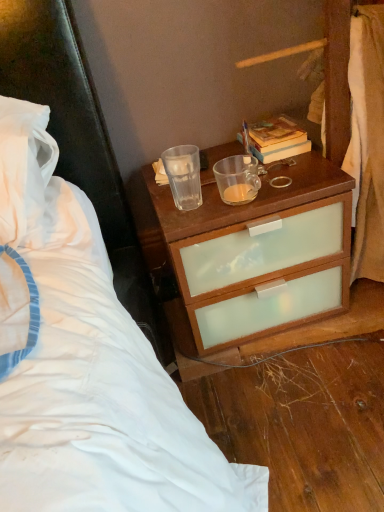
Describe the element at coordinates (277, 139) in the screenshot. This screenshot has width=384, height=512. I see `hardcover book at upper center` at that location.

This screenshot has width=384, height=512. What are the coordinates of `hardcover book at upper center` in the screenshot? It's located at (277, 139).

Measure the distance between hardcover book at upper center and camera.

The distance of hardcover book at upper center from camera is 1.09 meters.

I want to click on hardcover book at upper center, so click(x=277, y=139).